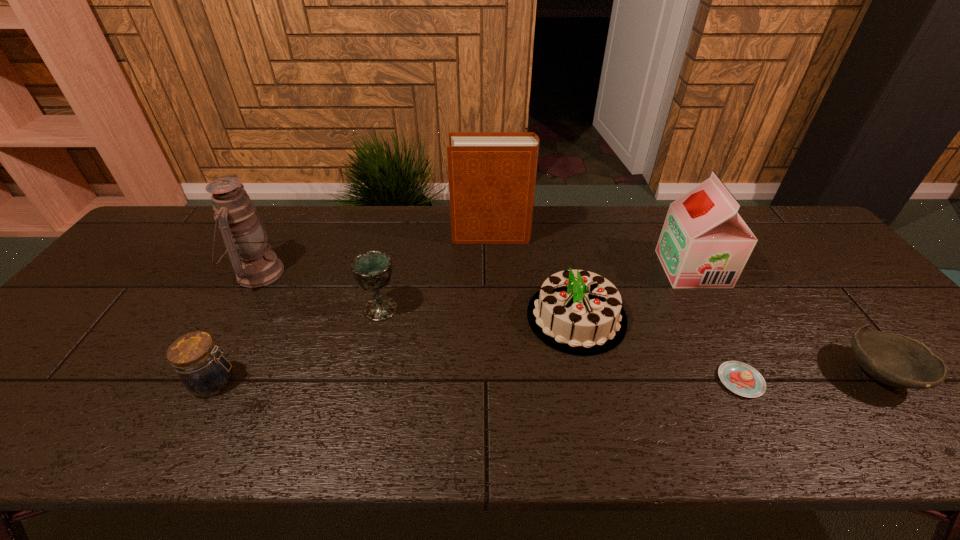
I want to click on vacant area situated on the left of the shortest object, so (x=581, y=381).

What are the coordinates of `object that is at the far edge` in the screenshot? It's located at pos(492,175).

The width and height of the screenshot is (960, 540). I want to click on object that is at the right edge, so click(x=896, y=360).

In the image, there is a desktop. Where is `vacant space at the far edge`? vacant space at the far edge is located at coordinates pyautogui.click(x=506, y=245).

Locate an element on the screen. vacant space at the left edge of the desktop is located at coordinates (159, 280).

You are a GUI agent. You are given a task and a screenshot of the screen. Output one action in this format:
    pyautogui.click(x=<x>, y=<y>)
    Task: Click on the vacant space at the right edge of the desktop
    This screenshot has width=960, height=540.
    Given the screenshot: What is the action you would take?
    pyautogui.click(x=833, y=262)

Find the location of a particular element. free area in between the birthday cake and the oil lamp is located at coordinates (418, 295).

Where is `vacant area between the chalice and the jar`? This screenshot has width=960, height=540. vacant area between the chalice and the jar is located at coordinates (298, 345).

The width and height of the screenshot is (960, 540). Identify the location of free space between the shortest object and the birthday cake. (659, 349).

The height and width of the screenshot is (540, 960). I want to click on empty location between the bowl and the birthday cake, so click(x=728, y=345).